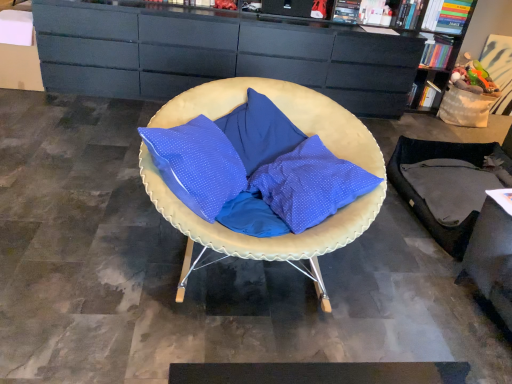
Question: From the image's perspective, is matte blue cushion at center positioned above or below matte black cabinet at upper center?

Choices:
 (A) above
 (B) below

Answer: (B)

Question: Considering the positions of matte blue cushion at center and matte black cabinet at upper center in the image, is matte blue cushion at center bigger or smaller than matte black cabinet at upper center?

Choices:
 (A) big
 (B) small

Answer: (B)

Question: Relative to matte black cabinet at upper center, is matte blue cushion at center in front or behind?

Choices:
 (A) behind
 (B) front

Answer: (B)

Question: Looking at the image, does matte black cabinet at upper center seem bigger or smaller compared to matte blue cushion at center?

Choices:
 (A) small
 (B) big

Answer: (B)

Question: Based on their positions, is matte black cabinet at upper center located to the left or right of matte blue cushion at center?

Choices:
 (A) left
 (B) right

Answer: (B)

Question: Looking at their shapes, would you say matte black cabinet at upper center is wider or thinner than matte blue cushion at center?

Choices:
 (A) wide
 (B) thin

Answer: (B)

Question: Is point (307, 44) closer or farther from the camera than point (148, 157)?

Choices:
 (A) closer
 (B) farther

Answer: (B)